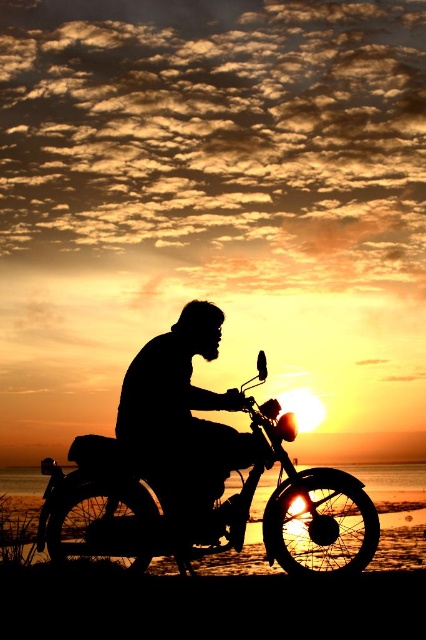
Question: Does silhouette man at center have a greater width compared to smooth sand at lower center?

Choices:
 (A) no
 (B) yes

Answer: (A)

Question: Which point is closer to the camera taking this photo?

Choices:
 (A) (281, 452)
 (B) (215, 328)

Answer: (A)

Question: Among these objects, which one is farthest from the camera?

Choices:
 (A) smooth sand at lower center
 (B) black matte dirt bike at center

Answer: (A)

Question: Does black matte dirt bike at center appear over smooth sand at lower center?

Choices:
 (A) no
 (B) yes

Answer: (B)

Question: Does silhouette man at center have a greater width compared to smooth sand at lower center?

Choices:
 (A) no
 (B) yes

Answer: (A)

Question: Which point is closer to the camera?

Choices:
 (A) (391, 509)
 (B) (88, 556)

Answer: (B)